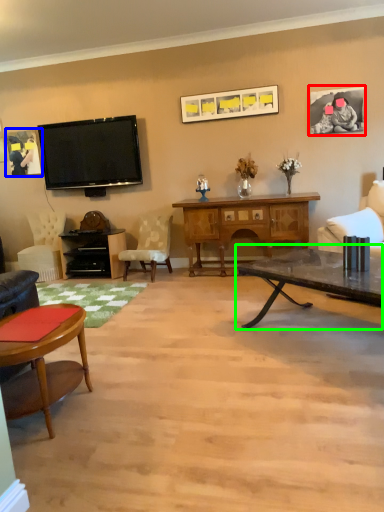
Question: Based on their relative distances, which object is farther from picture frame (highlighted by a red box)? Choose from picture frame (highlighted by a blue box) and coffee table (highlighted by a green box).

Choices:
 (A) picture frame
 (B) coffee table

Answer: (A)